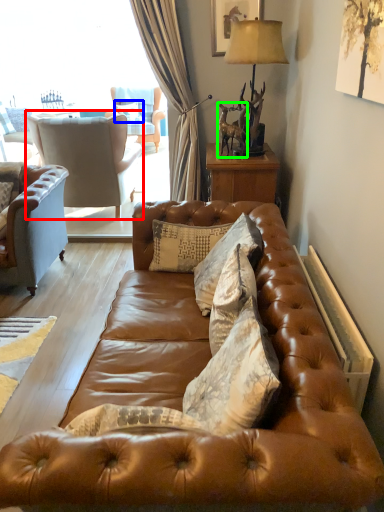
Question: Based on their relative distances, which object is farther from chair (highlighted by a red box)? Choose from pillow (highlighted by a blue box) and animal (highlighted by a green box).

Choices:
 (A) pillow
 (B) animal

Answer: (A)